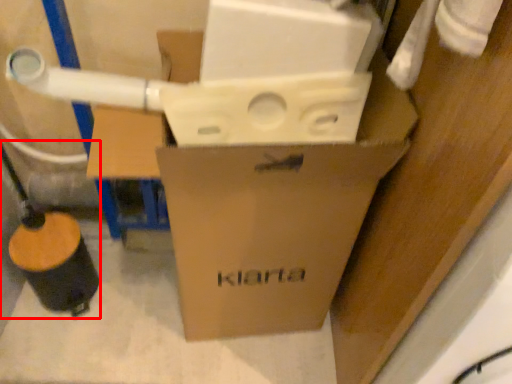
Question: From the image's perspective, considering the relative positions of water pipe (annotated by the red box) and box in the image provided, where is water pipe (annotated by the red box) located with respect to the staircase?

Choices:
 (A) above
 (B) below

Answer: (B)